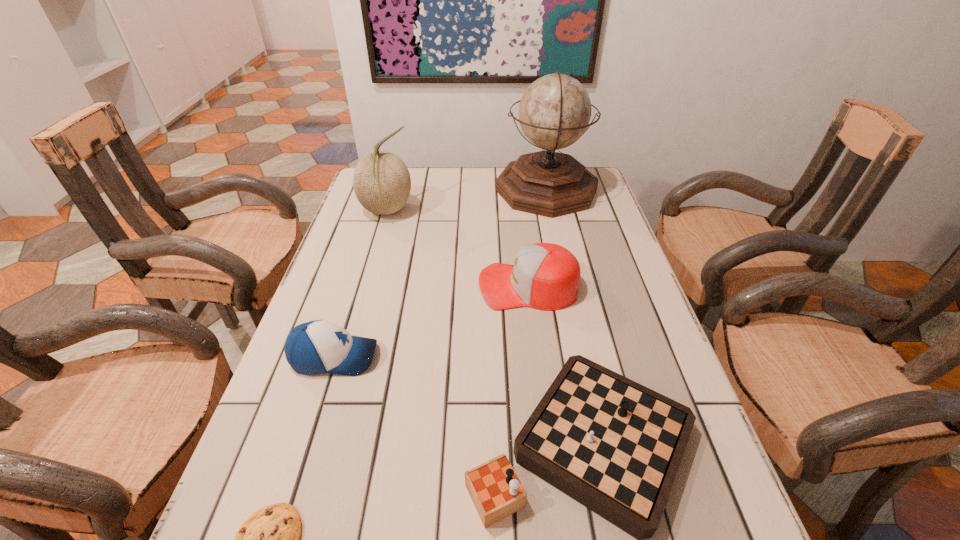
Locate an element on the screen. The width and height of the screenshot is (960, 540). object positioned at the far left corner is located at coordinates (381, 180).

Identify the location of object that is positioned at the far right corner. (554, 112).

Find the location of `vacant space at the far edge of the desktop`. vacant space at the far edge of the desktop is located at coordinates (414, 181).

Identify the location of vacant area at the left edge. (375, 274).

The image size is (960, 540). Identify the location of free space at the right edge of the desktop. (584, 227).

Image resolution: width=960 pixels, height=540 pixels. I want to click on free spot between the cantaloup and the left baseball cap, so click(x=360, y=284).

In order to click on vacant space in between the nearer baseball cap and the fifth shortest object in this screenshot , I will do `click(360, 284)`.

Point out which object is positioned as the fourth nearest to the left baseball cap. Please provide its 2D coordinates. Your answer should be formatted as a tuple, i.e. [(x, y)], where the tuple contains the x and y coordinates of a point satisfying the conditions above.

[(381, 180)]

Identify which object is located as the nearest to the cantaloup. Please provide its 2D coordinates. Your answer should be formatted as a tuple, i.e. [(x, y)], where the tuple contains the x and y coordinates of a point satisfying the conditions above.

[(554, 112)]